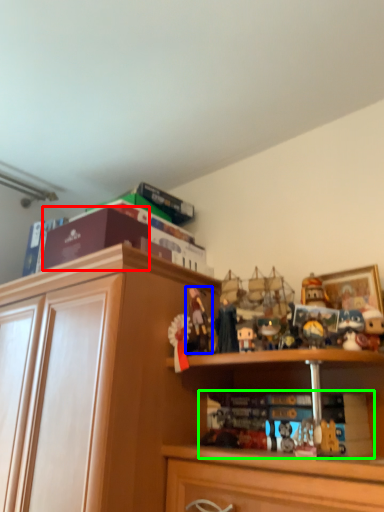
Question: Which object is the closest to the book (highlighted by a red box)? Choose among these: toy (highlighted by a blue box) or book (highlighted by a green box).

Choices:
 (A) toy
 (B) book

Answer: (A)